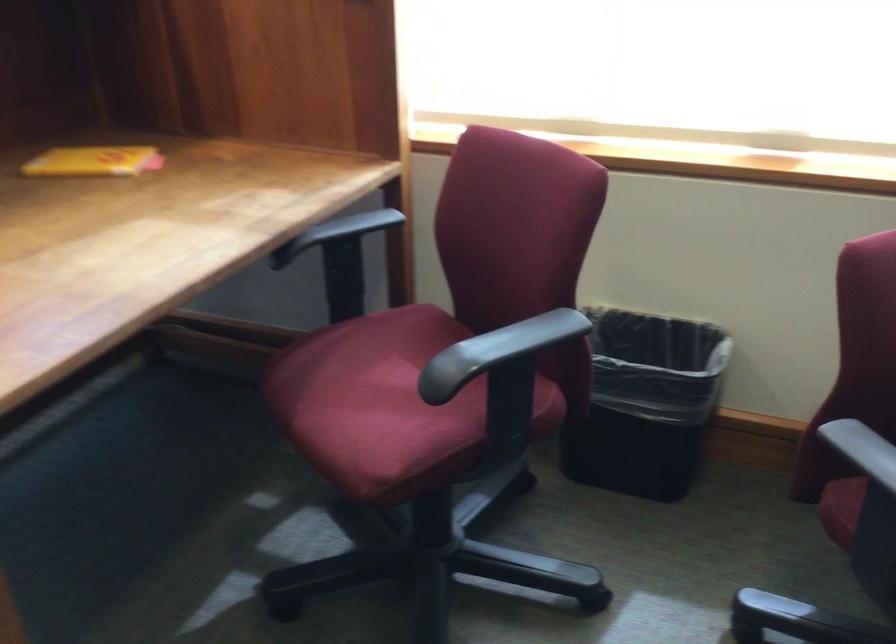
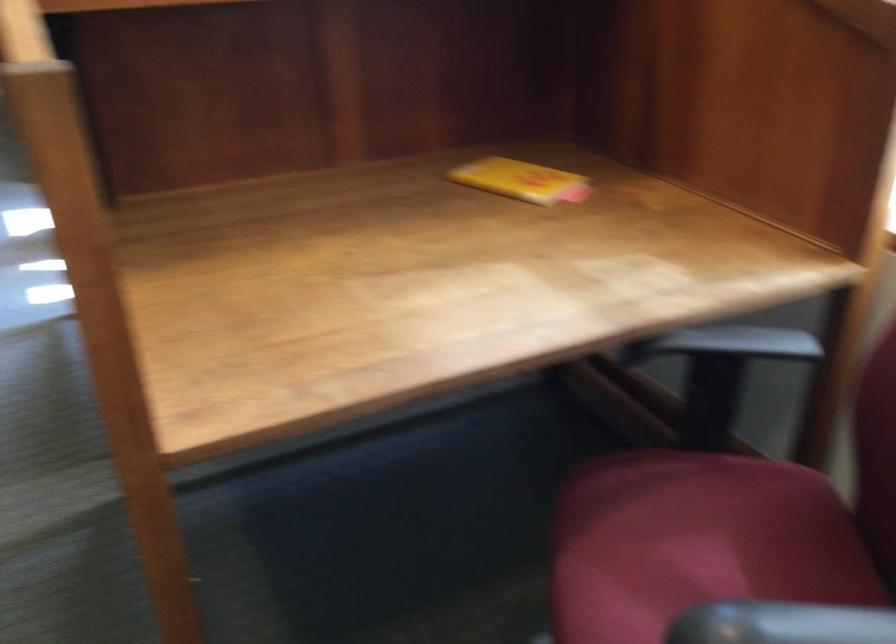
Find the pixel in the second image that matches [100,158] in the first image.

(521, 180)